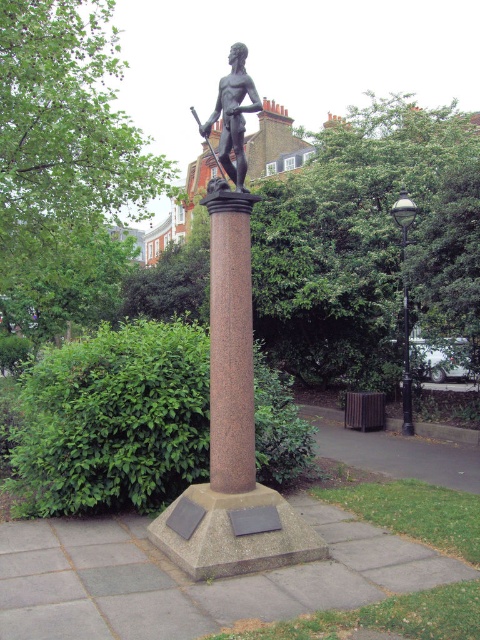
Can you confirm if bronze statue at center is positioned above black polished metal lamp post at right?

Yes.

Between point (236, 157) and point (408, 336), which one is positioned behind?

The point (408, 336) is behind.

Image resolution: width=480 pixels, height=640 pixels. What are the coordinates of `bronze statue at center` in the screenshot? It's located at (232, 115).

Can you confirm if granite column at center is shorter than bronze statue at center?

Yes.

The height and width of the screenshot is (640, 480). In order to click on granite column at center in this screenshot , I will do `click(230, 340)`.

The height and width of the screenshot is (640, 480). In order to click on granite column at center in this screenshot , I will do `click(230, 340)`.

Does granite column at center appear on the left side of black polished metal lamp post at right?

Indeed, granite column at center is positioned on the left side of black polished metal lamp post at right.

Is point (223, 385) farther from camera compared to point (407, 420)?

No, it is not.

Where is `granite column at center`? This screenshot has width=480, height=640. granite column at center is located at coordinates (230, 340).